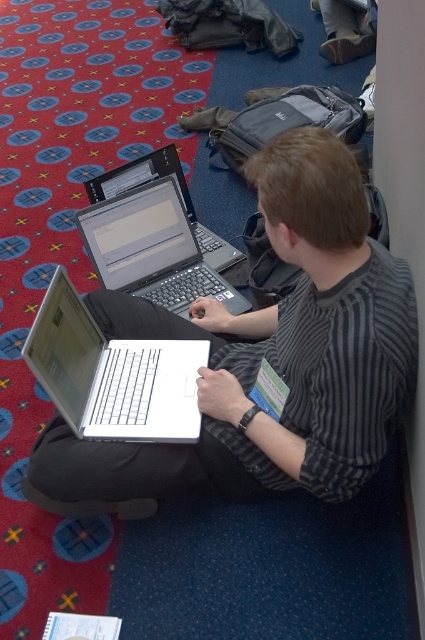
Question: Which object is closer to the camera taking this photo?

Choices:
 (A) white matte laptop at center
 (B) silver/black keyboard at center
 (C) white plastic laptop at center

Answer: (C)

Question: Estimate the real-world distances between objects in this image. Which object is farther from the white matte laptop at center?

Choices:
 (A) white plastic laptop at center
 (B) silver/black keyboard at center

Answer: (B)

Question: Can you confirm if white matte laptop at center is smaller than silver/black keyboard at center?

Choices:
 (A) no
 (B) yes

Answer: (A)

Question: Estimate the real-world distances between objects in this image. Which object is farther from the white plastic laptop at center?

Choices:
 (A) silver/black keyboard at center
 (B) white matte laptop at center

Answer: (A)

Question: Is white matte laptop at center further to camera compared to silver/black keyboard at center?

Choices:
 (A) yes
 (B) no

Answer: (B)

Question: Where is white matte laptop at center located in relation to silver/black keyboard at center in the image?

Choices:
 (A) below
 (B) above

Answer: (A)